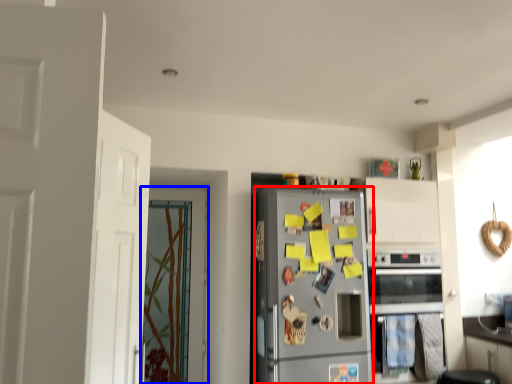
Question: Which point is further to the camera, refrigerator (highlighted by a red box) or door (highlighted by a blue box)?

Choices:
 (A) refrigerator
 (B) door

Answer: (B)